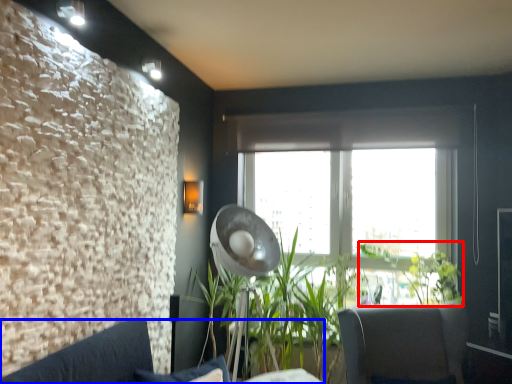
Question: Which of the following is the closest to the observer, plant (highlighted by a red box) or studio couch (highlighted by a blue box)?

Choices:
 (A) plant
 (B) studio couch

Answer: (B)